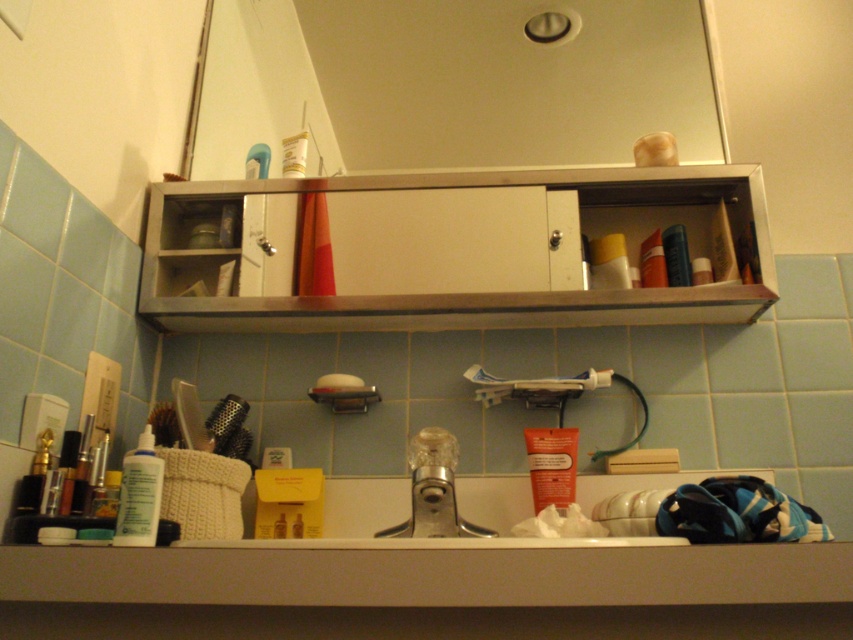
How much distance is there between clear glass faucet at center and yellow matte tube at upper center?

clear glass faucet at center is 45.21 centimeters from yellow matte tube at upper center.

Who is positioned more to the right, clear glass faucet at center or yellow matte tube at upper center?

Positioned to the right is yellow matte tube at upper center.

Is point (418, 518) positioned in front of point (627, 280)?

Yes, it is in front of point (627, 280).

Locate an element on the screen. The height and width of the screenshot is (640, 853). clear glass faucet at center is located at coordinates (433, 490).

This screenshot has width=853, height=640. Describe the element at coordinates (451, 83) in the screenshot. I see `metallic mirror at upper center` at that location.

Can you confirm if metallic mirror at upper center is shorter than metallic cabinet at center?

Incorrect, metallic mirror at upper center's height does not fall short of metallic cabinet at center's.

The height and width of the screenshot is (640, 853). Find the location of `metallic mirror at upper center`. metallic mirror at upper center is located at coordinates (451, 83).

At what (x,y) coordinates should I click in order to perform the action: click on metallic mirror at upper center. Please return your answer as a coordinate pair (x, y). Looking at the image, I should click on (451, 83).

Is metallic cabinet at center bigger than white matte lotion at left?

Yes, metallic cabinet at center is bigger than white matte lotion at left.

Is metallic cabinet at center positioned in front of white matte lotion at left?

That is False.

Find the location of a particular element. Image resolution: width=853 pixels, height=640 pixels. metallic cabinet at center is located at coordinates (450, 250).